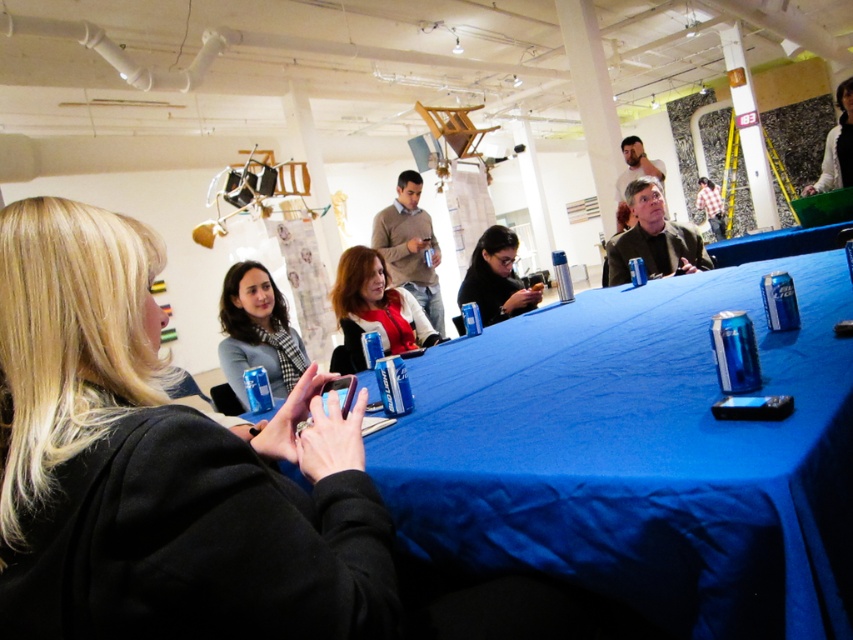
You are organizing a small event and need to place a decorative centerpiece on the table. Given the sizes of the blue fabric table at center and the blonde hair at center, which object can accommodate the centerpiece?

The blue fabric table at center has a larger size compared to the blonde hair at center, so the centerpiece can be placed on the blue fabric table at center.

You are a photographer standing in the room and want to take a photo of the blue fabric table at center and the white fabric jacket at upper right. Which object will appear larger in the photo?

The blue fabric table at center will appear larger in the photo because it is closer to the viewer than the white fabric jacket at upper right.

You are standing at the entrance of the room and want to locate the person with the blonde hair at center. Based on the coordinates provided, where should you look to find them?

The blonde hair at center is located at the coordinates point (160,467), so you should look towards the lower right area of the image to find them.